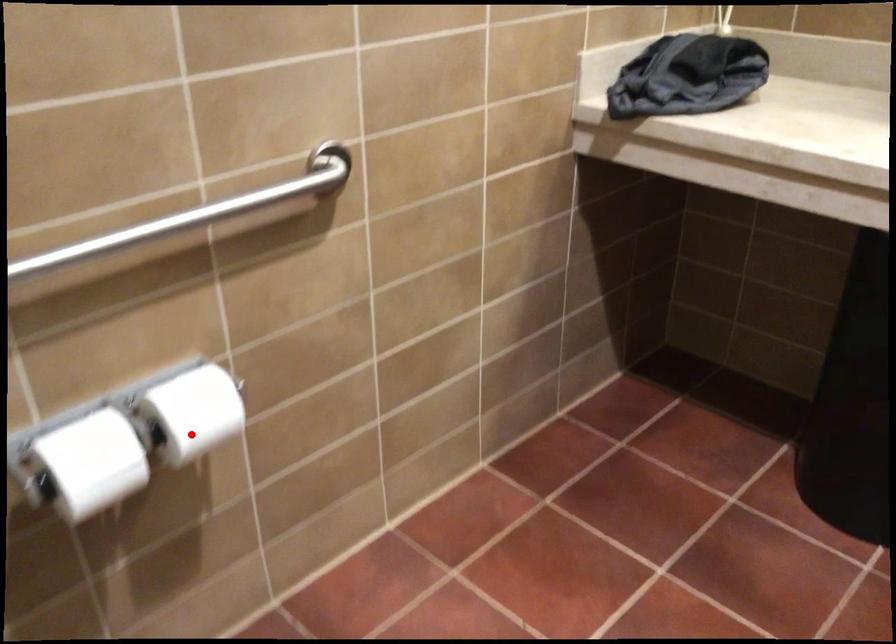
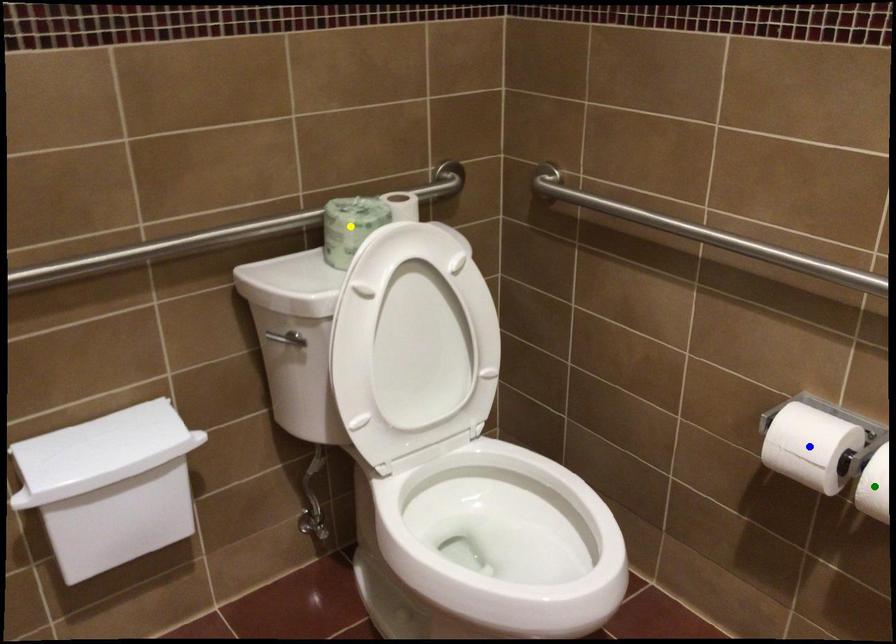
Question: I am providing you with two images of the same scene from different viewpoints. A red point is marked on the first image. You are given multiple points on the second image. Which mark in image 2 goes with the point in image 1?

Choices:
 (A) yellow point
 (B) green point
 (C) blue point

Answer: (B)